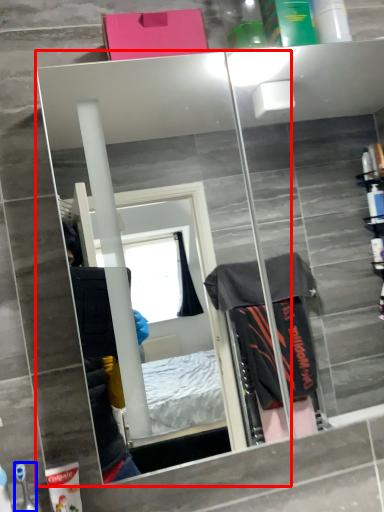
Question: Which point is closer to the camera, mirror (highlighted by a red box) or toiletry (highlighted by a blue box)?

Choices:
 (A) mirror
 (B) toiletry

Answer: (A)